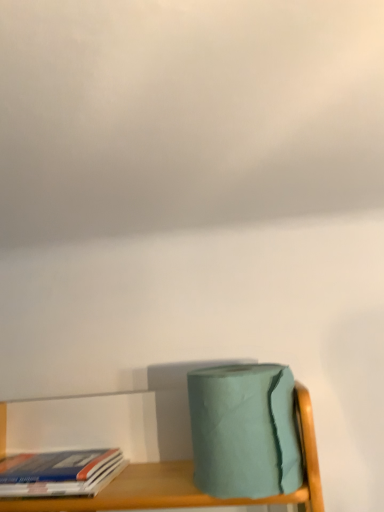
Where is `teal matte toilet paper at lower right`? This screenshot has width=384, height=512. teal matte toilet paper at lower right is located at coordinates (244, 431).

Is cloudy white sky at upper center in front of or behind teal matte toilet paper at lower right in the image?

Visually, cloudy white sky at upper center is located in front of teal matte toilet paper at lower right.

Which is more to the left, cloudy white sky at upper center or teal matte toilet paper at lower right?

cloudy white sky at upper center is more to the left.

Is cloudy white sky at upper center oriented towards teal matte toilet paper at lower right?

No, cloudy white sky at upper center is not facing towards teal matte toilet paper at lower right.

Considering the positions of points (161, 118) and (276, 375), is point (161, 118) farther from camera compared to point (276, 375)?

No.

Locate an element on the screen. Image resolution: width=384 pixels, height=512 pixels. cloud in front of the hardcover book at lower left is located at coordinates (185, 114).

From the picture: Is hardcover book at lower left positioned behind cloudy white sky at upper center?

That is True.

Looking at this image, which of these two, hardcover book at lower left or cloudy white sky at upper center, is wider?

Wider between the two is cloudy white sky at upper center.

Which is correct: hardcover book at lower left is inside cloudy white sky at upper center, or outside of it?

The correct answer is: outside.

Identify the location of cloud above the teal matte toilet paper at lower right (from a real-world perspective). Image resolution: width=384 pixels, height=512 pixels. (185, 114).

Are teal matte toilet paper at lower right and cloudy white sky at upper center far apart?

No.

Is cloudy white sky at upper center inside teal matte toilet paper at lower right?

No.

How many degrees apart are the facing directions of cloudy white sky at upper center and hardcover book at lower left?

The facing directions of cloudy white sky at upper center and hardcover book at lower left are 87.9 degrees apart.

Image resolution: width=384 pixels, height=512 pixels. Find the location of `book that appears below the cloudy white sky at upper center (from a real-world perspective)`. book that appears below the cloudy white sky at upper center (from a real-world perspective) is located at coordinates (59, 473).

Is cloudy white sky at upper center facing towards hardcover book at lower left?

No, cloudy white sky at upper center does not turn towards hardcover book at lower left.

Which is correct: cloudy white sky at upper center is inside hardcover book at lower left, or outside of it?

cloudy white sky at upper center is not inside hardcover book at lower left, it's outside.

Considering the sizes of teal matte toilet paper at lower right and hardcover book at lower left in the image, is teal matte toilet paper at lower right taller or shorter than hardcover book at lower left?

In the image, teal matte toilet paper at lower right appears to be taller than hardcover book at lower left.

Considering the positions of points (270, 376) and (119, 455), is point (270, 376) closer to camera compared to point (119, 455)?

Yes.

Is teal matte toilet paper at lower right not inside hardcover book at lower left?

Absolutely, teal matte toilet paper at lower right is external to hardcover book at lower left.

You are a GUI agent. You are given a task and a screenshot of the screen. Output one action in this format:
    pyautogui.click(x=<x>, y=<y>)
    Task: Click on the toilet paper that appears on the right of hardcover book at lower left
    The height and width of the screenshot is (512, 384).
    Given the screenshot: What is the action you would take?
    click(244, 431)

Is hardcover book at lower left bigger or smaller than teal matte toilet paper at lower right?

In the image, hardcover book at lower left appears to be smaller than teal matte toilet paper at lower right.

How distant is hardcover book at lower left from teal matte toilet paper at lower right?

The distance of hardcover book at lower left from teal matte toilet paper at lower right is 11.94 inches.

From a real-world perspective, is hardcover book at lower left positioned above or below teal matte toilet paper at lower right?

In terms of real-world spatial position, hardcover book at lower left is below teal matte toilet paper at lower right.

Which is correct: hardcover book at lower left is inside teal matte toilet paper at lower right, or outside of it?

hardcover book at lower left is not enclosed by teal matte toilet paper at lower right.

Identify the location of toilet paper on the right of cloudy white sky at upper center. (244, 431).

Locate an element on the screen. book directly beneath the cloudy white sky at upper center (from a real-world perspective) is located at coordinates (59, 473).

Which object lies nearer to the anchor point teal matte toilet paper at lower right, hardcover book at lower left or cloudy white sky at upper center?

Among the two, hardcover book at lower left is located nearer to teal matte toilet paper at lower right.

Based on their spatial positions, is teal matte toilet paper at lower right or cloudy white sky at upper center closer to hardcover book at lower left?

Among the two, teal matte toilet paper at lower right is located nearer to hardcover book at lower left.

Which object lies further to the anchor point teal matte toilet paper at lower right, cloudy white sky at upper center or hardcover book at lower left?

The object further to teal matte toilet paper at lower right is cloudy white sky at upper center.

Estimate the real-world distances between objects in this image. Which object is further from hardcover book at lower left, cloudy white sky at upper center or teal matte toilet paper at lower right?

The object further to hardcover book at lower left is cloudy white sky at upper center.

Considering their positions, is hardcover book at lower left positioned closer to cloudy white sky at upper center than teal matte toilet paper at lower right?

teal matte toilet paper at lower right lies closer to cloudy white sky at upper center than the other object.

Considering their positions, is teal matte toilet paper at lower right positioned closer to cloudy white sky at upper center than hardcover book at lower left?

teal matte toilet paper at lower right is positioned closer to the anchor cloudy white sky at upper center.

Where is `toilet paper between cloudy white sky at upper center and hardcover book at lower left in the up-down direction`? The width and height of the screenshot is (384, 512). toilet paper between cloudy white sky at upper center and hardcover book at lower left in the up-down direction is located at coordinates (244, 431).